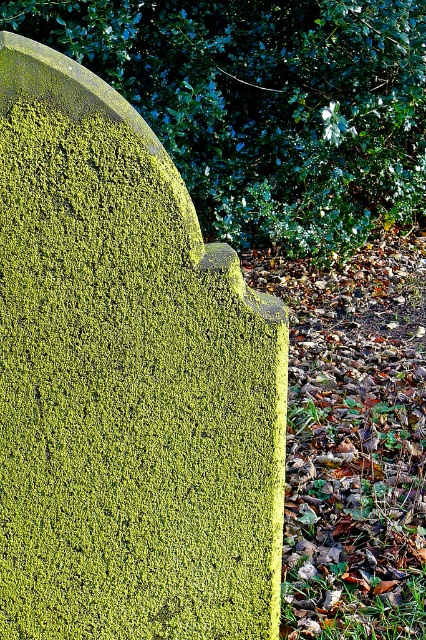
Does green mossy gravestone at center appear over green mossy stone at upper center?

Actually, green mossy gravestone at center is below green mossy stone at upper center.

Looking at this image, does green mossy gravestone at center have a larger size compared to green mossy stone at upper center?

No, green mossy gravestone at center is not bigger than green mossy stone at upper center.

Identify the location of green mossy gravestone at center. tap(126, 381).